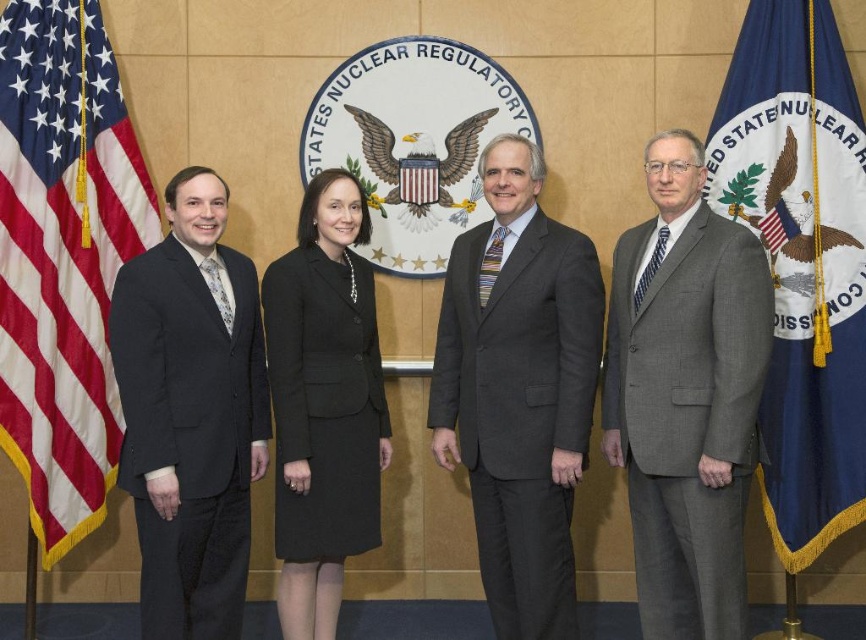
You are an attendee at a USNRC event and need to find the gray wool suit at right. Based on the coordinates provided, where should you look relative to the American flag on the left?

The gray wool suit at right is located at coordinates point (684,394), which is to the right of the American flag on the left.

You are a photographer preparing to take a group photo of the individuals in front of the USNRC backdrop. You need to ensure that the person wearing the gray wool suit at center and the person wearing the black wool skirt at center are positioned correctly according to their attire. From the photographer perspective, which person is standing to the right of the other?

The gray wool suit at center is to the right of the black wool skirt at center, so the person in the gray wool suit at center is standing to the right of the person in the black wool skirt at center.

You are standing in front of the USNRC backdrop and see the point at coordinates (684, 394). What object is located at that point?

The point at coordinates (684, 394) indicates a gray wool suit at right.